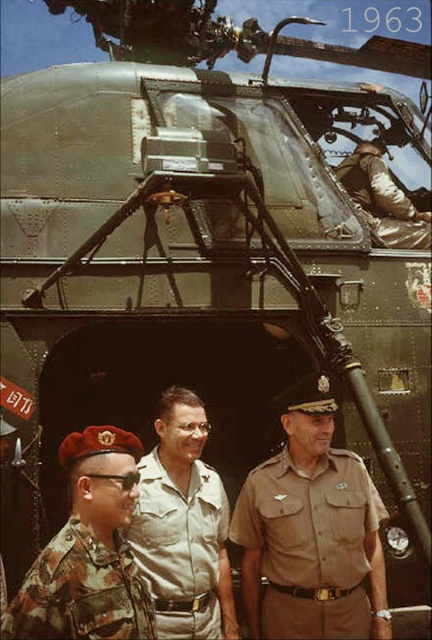
Question: Estimate the real-world distances between objects in this image. Which object is farther from the camouflage fabric shirt at center?

Choices:
 (A) camouflage fabric uniform at lower left
 (B) tan fabric uniform at center
 (C) brown matte uniform at center

Answer: (B)

Question: Can you confirm if brown matte uniform at center is smaller than camouflage fabric uniform at lower left?

Choices:
 (A) no
 (B) yes

Answer: (A)

Question: Estimate the real-world distances between objects in this image. Which object is closer to the camouflage fabric shirt at center?

Choices:
 (A) camouflage fabric uniform at lower left
 (B) tan fabric uniform at center

Answer: (A)

Question: Which point is farther from the camera taking this photo?

Choices:
 (A) [349, 188]
 (B) [264, 627]

Answer: (A)

Question: Is camouflage fabric shirt at center above tan fabric uniform at center?

Choices:
 (A) yes
 (B) no

Answer: (B)

Question: In this image, where is brown matte uniform at center located relative to camouflage fabric shirt at center?

Choices:
 (A) above
 (B) below

Answer: (B)